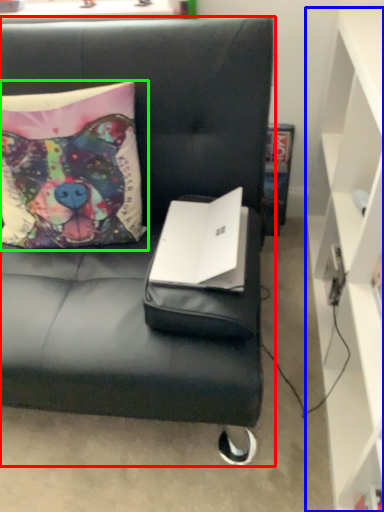
Question: Which object is positioned farthest from studio couch (highlighted by a red box)? Select from cabinetry (highlighted by a blue box) and pillow (highlighted by a green box).

Choices:
 (A) cabinetry
 (B) pillow

Answer: (A)